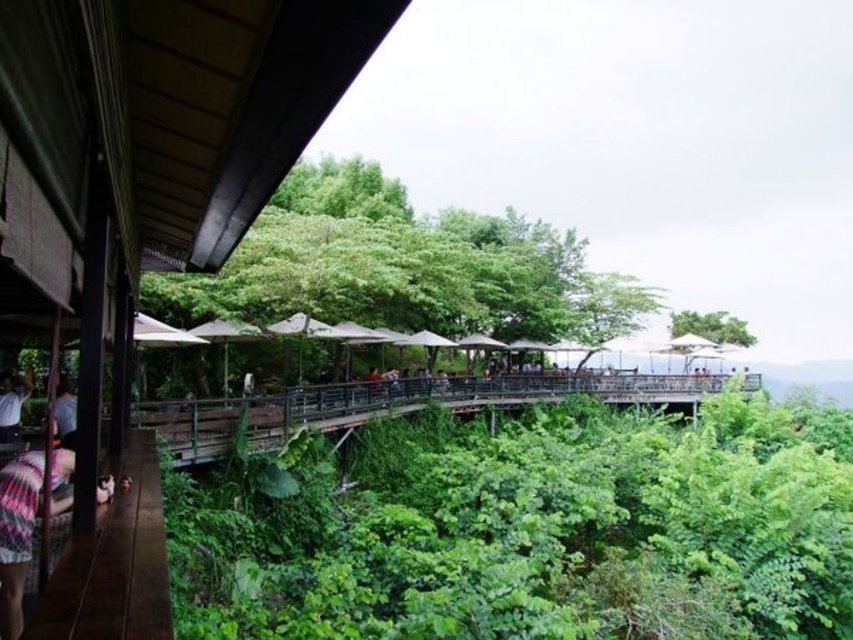
You are standing at the entrance of the wooden walkway leading to the platform. You want to take a photo of the green leafy tree at center from as close as possible without leaving the walkway. How far will you have to stand from the tree?

The green leafy tree at center is 44.07 feet away from the viewer, so you will have to stand approximately 44.07 feet away from it to take the photo while remaining on the walkway.

You are a customer entering the outdoor restaurant and see the plaid fabric at lower left and the green leafy tree at upper center. Which object is nearer to you as you stand at the entrance?

The plaid fabric at lower left is closer to the viewer than the green leafy tree at upper center, so the plaid fabric at lower left is nearer to you as you stand at the entrance.